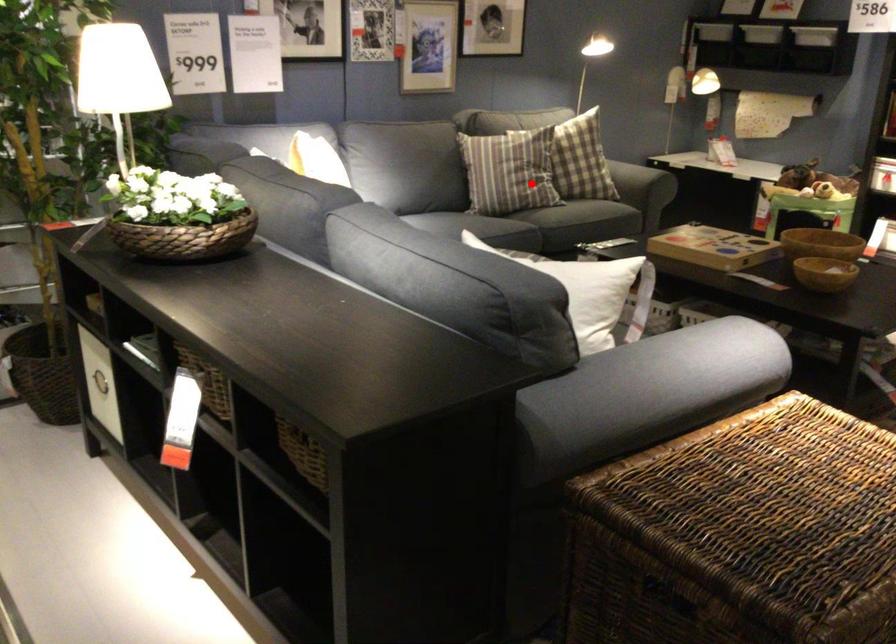
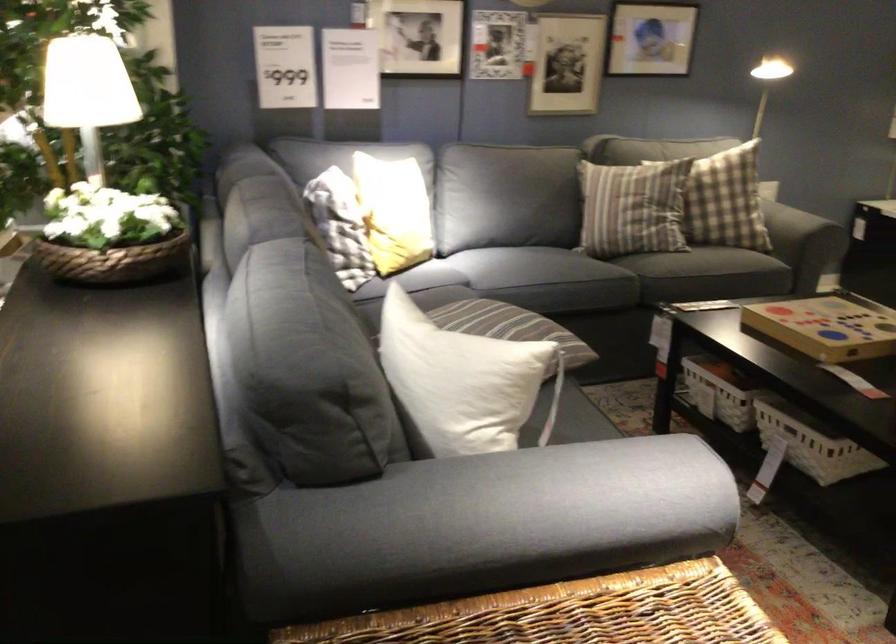
Question: I am providing you with two images of the same scene from different viewpoints. In image1, a red point is highlighted. Considering the same 3D point in image2, which of the following is correct?

Choices:
 (A) It is closer
 (B) It is farther

Answer: (A)